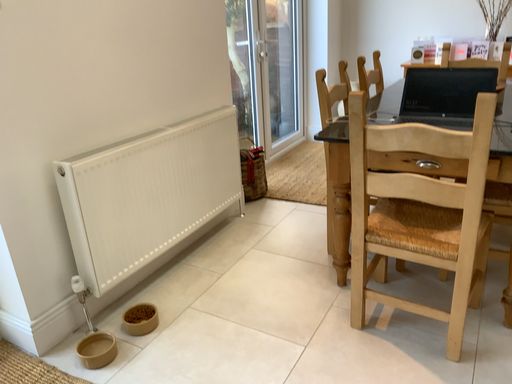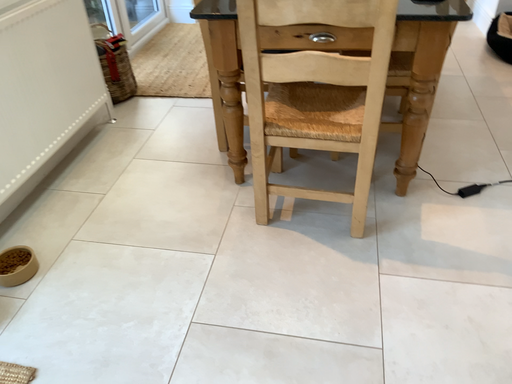
Question: How did the camera likely rotate when shooting the video?

Choices:
 (A) rotated downward
 (B) rotated upward

Answer: (A)